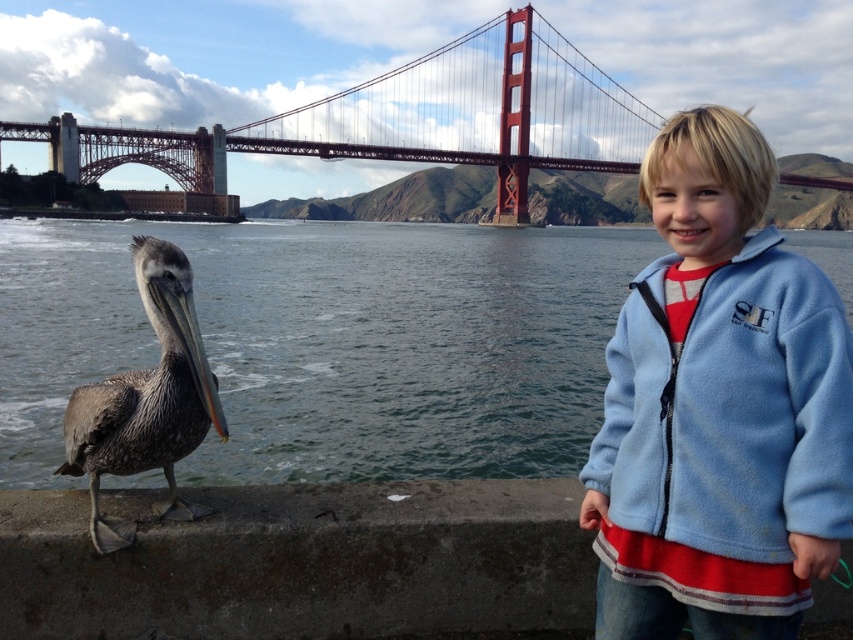
Question: Which point appears closest to the camera in this image?

Choices:
 (A) (117, 433)
 (B) (433, 64)

Answer: (A)

Question: Which point appears farthest from the camera in this image?

Choices:
 (A) (469, 312)
 (B) (505, 76)
 (C) (610, 400)

Answer: (B)

Question: Can you confirm if clear water at lower left is thinner than brown feathered pelican at lower left?

Choices:
 (A) yes
 (B) no

Answer: (B)

Question: Is clear water at lower left closer to the viewer compared to metallic red bridge at upper center?

Choices:
 (A) yes
 (B) no

Answer: (A)

Question: Considering the relative positions of blue fleece jacket at right and brown feathered pelican at lower left in the image provided, where is blue fleece jacket at right located with respect to brown feathered pelican at lower left?

Choices:
 (A) right
 (B) left

Answer: (A)

Question: Which point is closer to the camera taking this photo?

Choices:
 (A) [195, 413]
 (B) [662, 224]

Answer: (A)